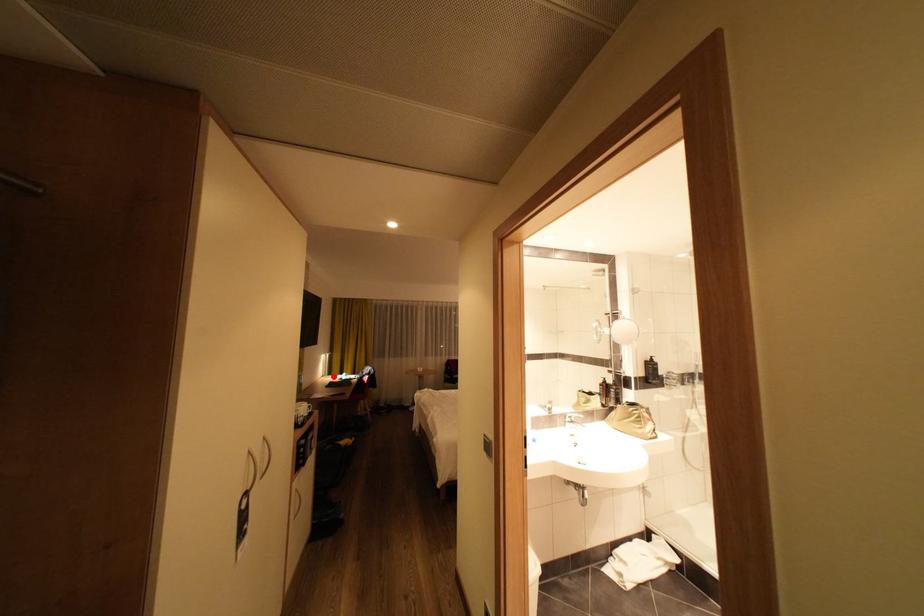
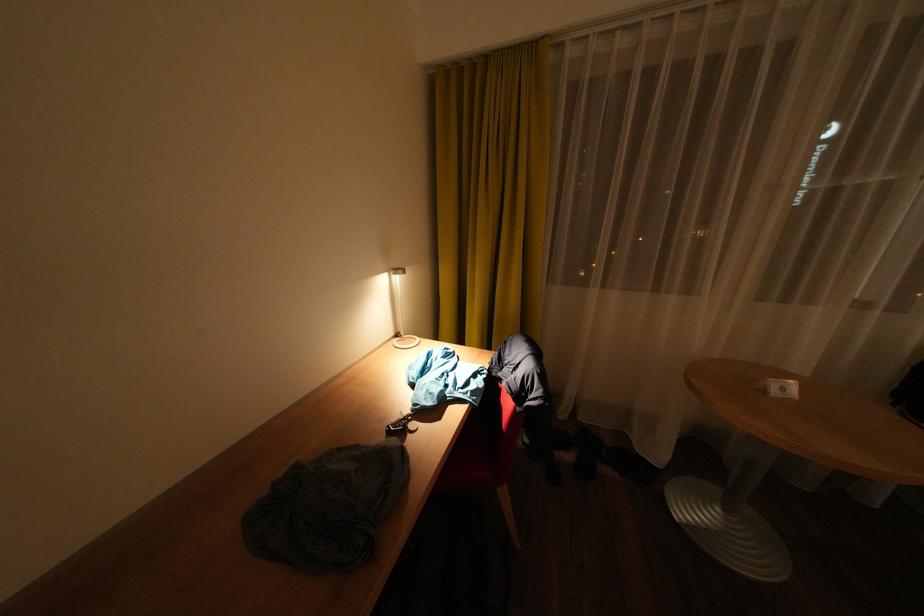
Where in the second image is the point corresponding to the highlighted location from the first image?

(407, 336)